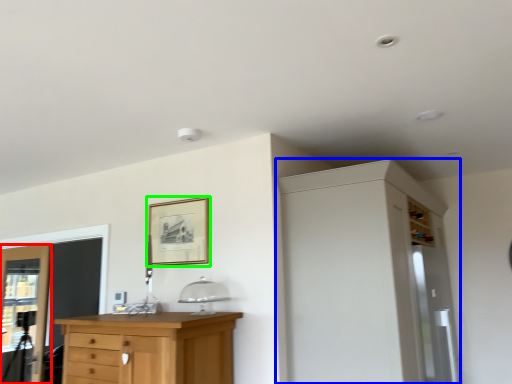
Question: Which object is positioned farthest from door (highlighted by a red box)? Select from dresser (highlighted by a blue box) and picture frame (highlighted by a green box).

Choices:
 (A) dresser
 (B) picture frame

Answer: (A)